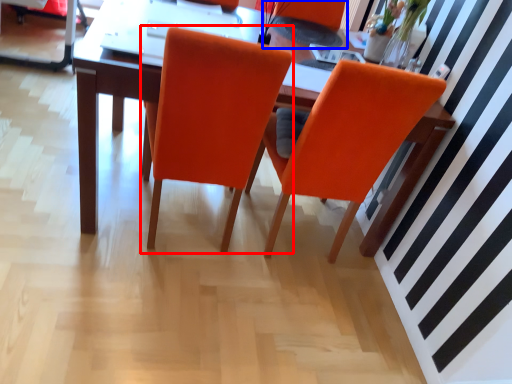
Question: Which object is closer to the camera taking this photo, chair (highlighted by a red box) or armchair (highlighted by a blue box)?

Choices:
 (A) chair
 (B) armchair

Answer: (A)